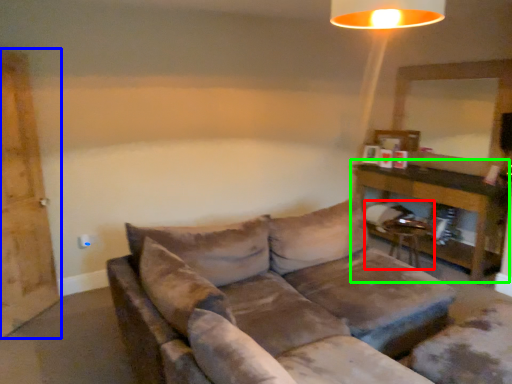
Question: Considering the real-world distances, which object is closest to swivel chair (highlighted by a red box)? barn door (highlighted by a blue box) or table (highlighted by a green box).

Choices:
 (A) barn door
 (B) table

Answer: (B)